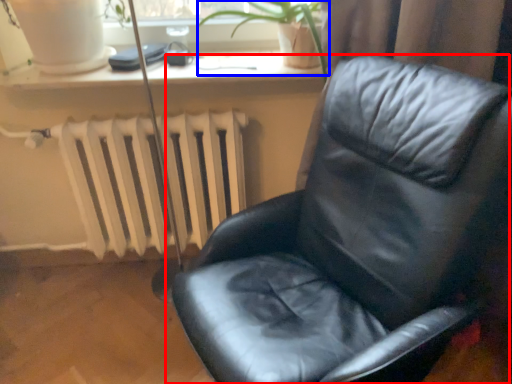
Question: Which point is further to the camera, chair (highlighted by a red box) or plant (highlighted by a blue box)?

Choices:
 (A) chair
 (B) plant

Answer: (B)